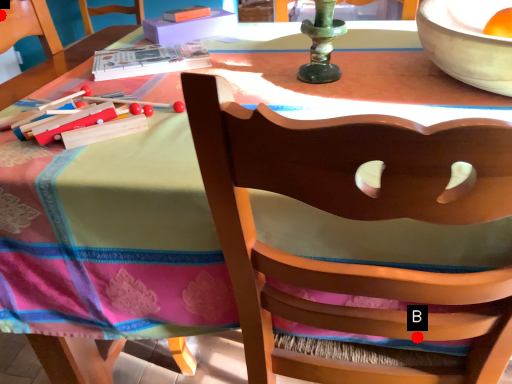
Question: Two points are circled on the image, labeled by A and B beside each circle. Which of the following is the closest to the observer?

Choices:
 (A) A is closer
 (B) B is closer

Answer: (B)